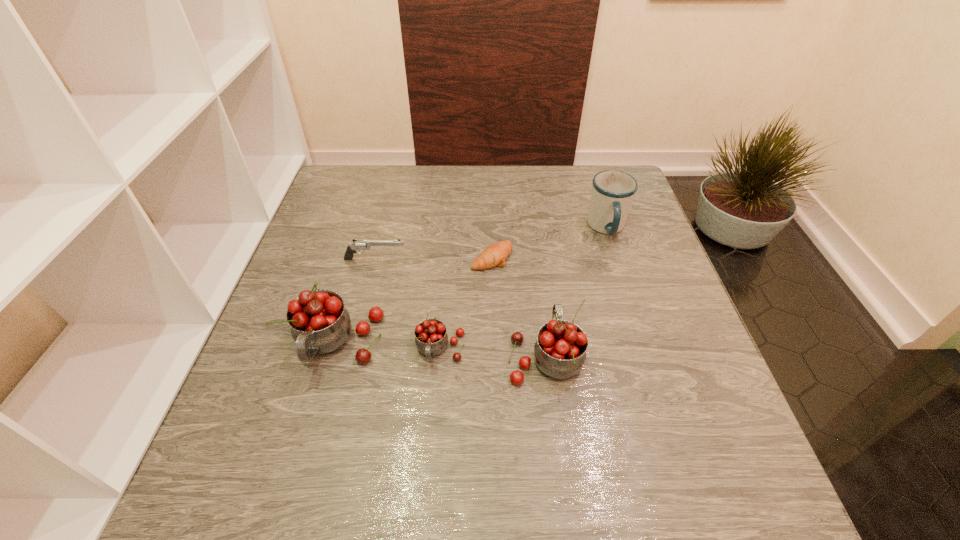
Where is `vacant space that is in between the second shortest object and the crescent roll`? The height and width of the screenshot is (540, 960). vacant space that is in between the second shortest object and the crescent roll is located at coordinates (x=434, y=259).

Identify the location of free space between the second shortest object and the second tallest cherry. This screenshot has width=960, height=540. (460, 307).

I want to click on vacant space that's between the crescent roll and the rightmost cherry, so click(518, 307).

Locate an element on the screen. free space between the second cherry from right to left and the rightmost cherry is located at coordinates (492, 353).

In order to click on the third closest object to the leftmost cherry in this screenshot , I will do 494,255.

Where is `object that is the second closest to the rightmost cherry`? object that is the second closest to the rightmost cherry is located at coordinates (494, 255).

Where is `cherry that is the closest to the shortest cherry`? cherry that is the closest to the shortest cherry is located at coordinates (320, 324).

Select which cherry is the closest to the rightmost cherry. Please provide its 2D coordinates. Your answer should be formatted as a tuple, i.e. [(x, y)], where the tuple contains the x and y coordinates of a point satisfying the conditions above.

[(431, 338)]

Where is `free region that satisfies the following two spatial constraints: 1. on the handle side of the mug; 2. on the front-facing side of the fifth tallest object`? This screenshot has width=960, height=540. free region that satisfies the following two spatial constraints: 1. on the handle side of the mug; 2. on the front-facing side of the fifth tallest object is located at coordinates (617, 259).

The height and width of the screenshot is (540, 960). I want to click on vacant space that satisfies the following two spatial constraints: 1. on the front-facing side of the pistol; 2. on the handle side of the rightmost cherry, so click(351, 356).